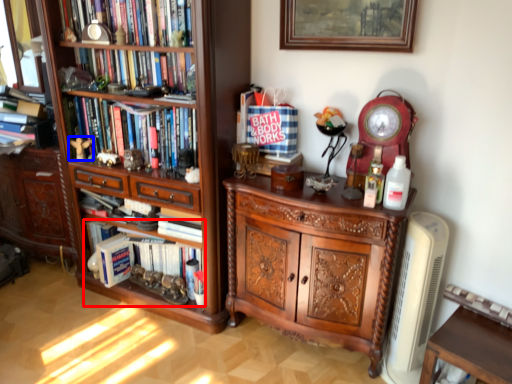
Question: Which object is closer to the camera taking this photo, book (highlighted by a red box) or toy (highlighted by a blue box)?

Choices:
 (A) book
 (B) toy

Answer: (A)